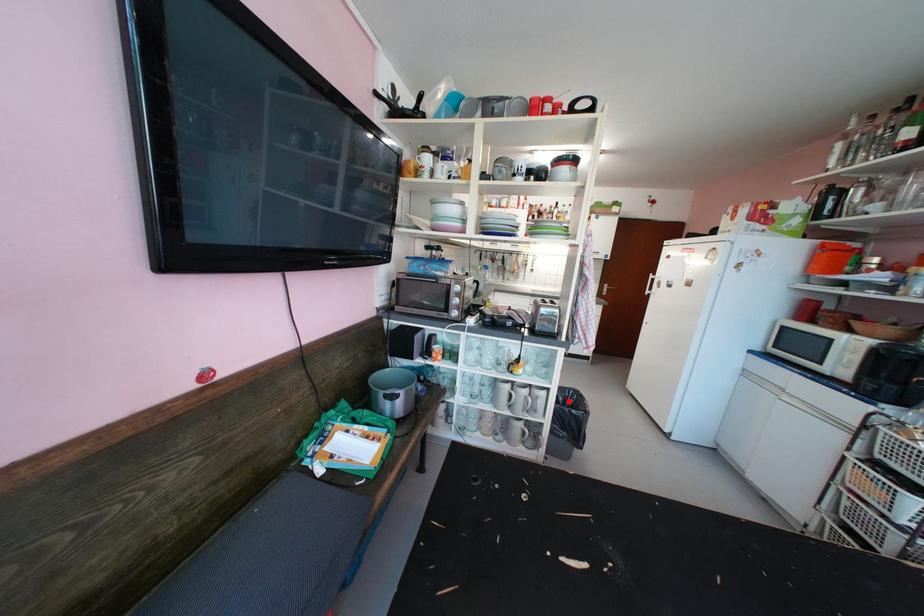
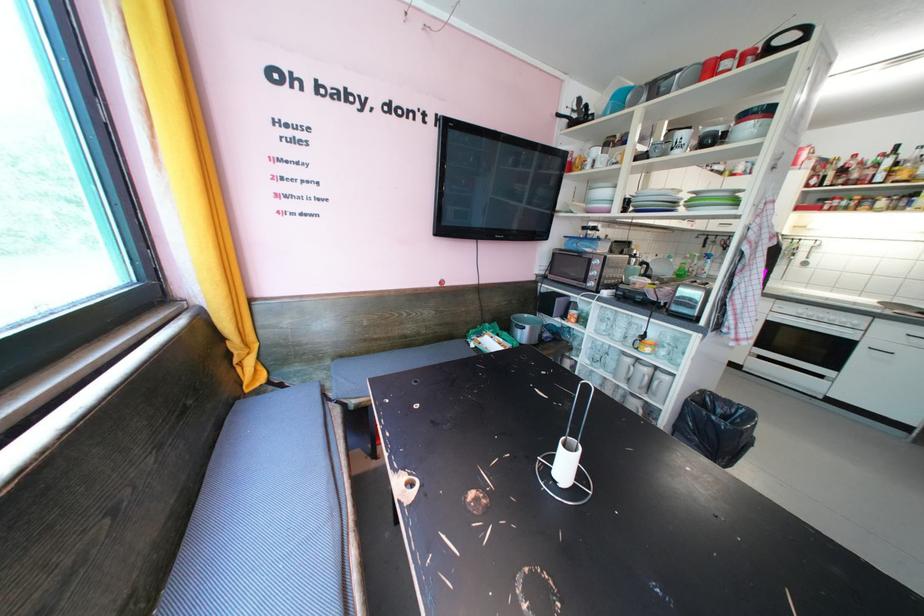
In the second image, find the point that corresponds to the highlighted location in the first image.

(727, 413)